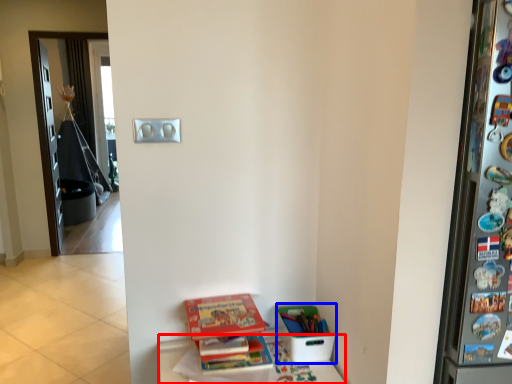
Question: Among these objects, which one is farthest to the camera, furniture (highlighted by a red box) or box (highlighted by a blue box)?

Choices:
 (A) furniture
 (B) box

Answer: (B)